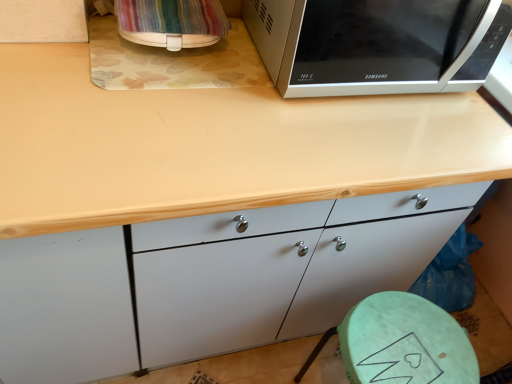
The height and width of the screenshot is (384, 512). Describe the element at coordinates (170, 22) in the screenshot. I see `striped fabric bag at upper left` at that location.

Describe the element at coordinates (215, 146) in the screenshot. I see `wooden at upper center` at that location.

Where is `sleek silver microwave at upper right`? sleek silver microwave at upper right is located at coordinates (368, 44).

The image size is (512, 384). Identify the location of green matte stool at lower right. (402, 343).

Which of these two, striped fabric bag at upper left or wooden at upper center, is wider?

wooden at upper center.

Looking at the image, does striped fabric bag at upper left seem bigger or smaller compared to wooden at upper center?

In the image, striped fabric bag at upper left appears to be smaller than wooden at upper center.

Considering the positions of objects striped fabric bag at upper left and wooden at upper center in the image provided, who is more to the right, striped fabric bag at upper left or wooden at upper center?

Positioned to the right is wooden at upper center.

From the image's perspective, which is above, striped fabric bag at upper left or wooden at upper center?

striped fabric bag at upper left is shown above in the image.

Does sleek silver microwave at upper right appear on the left side of wooden at upper center?

No, sleek silver microwave at upper right is not to the left of wooden at upper center.

Considering the sizes of sleek silver microwave at upper right and wooden at upper center in the image, is sleek silver microwave at upper right wider or thinner than wooden at upper center?

sleek silver microwave at upper right is thinner than wooden at upper center.

Identify the location of microwave oven above the wooden at upper center (from the image's perspective). This screenshot has height=384, width=512. (368, 44).

Is sleek silver microwave at upper right inside or outside of wooden at upper center?

sleek silver microwave at upper right cannot be found inside wooden at upper center.

In terms of width, does striped fabric bag at upper left look wider or thinner when compared to sleek silver microwave at upper right?

Considering their sizes, striped fabric bag at upper left looks slimmer than sleek silver microwave at upper right.

Can you confirm if striped fabric bag at upper left is positioned to the left of sleek silver microwave at upper right?

Yes, striped fabric bag at upper left is to the left of sleek silver microwave at upper right.

Who is bigger, striped fabric bag at upper left or sleek silver microwave at upper right?

With larger size is sleek silver microwave at upper right.

Between green matte stool at lower right and wooden at upper center, which one appears on the right side from the viewer's perspective?

green matte stool at lower right.

Which of these two, green matte stool at lower right or wooden at upper center, stands shorter?

Standing shorter between the two is green matte stool at lower right.

Does green matte stool at lower right have a smaller size compared to wooden at upper center?

Indeed, green matte stool at lower right has a smaller size compared to wooden at upper center.

From the image's perspective, relative to wooden at upper center, is green matte stool at lower right above or below?

green matte stool at lower right is situated lower than wooden at upper center in the image.

From a real-world perspective, between sleek silver microwave at upper right and green matte stool at lower right, who is vertically higher?

sleek silver microwave at upper right is physically above.

In the scene shown: Is sleek silver microwave at upper right positioned far away from green matte stool at lower right?

No, there isn't a large distance between sleek silver microwave at upper right and green matte stool at lower right.

The height and width of the screenshot is (384, 512). Find the location of `round table that is on the right side of sleek silver microwave at upper right`. round table that is on the right side of sleek silver microwave at upper right is located at coordinates (402, 343).

Between point (357, 335) and point (155, 15), which one is positioned behind?

The point (357, 335) is farther.

Is green matte stool at lower right thinner than striped fabric bag at upper left?

No, green matte stool at lower right is not thinner than striped fabric bag at upper left.

From the image's perspective, which object appears higher, green matte stool at lower right or striped fabric bag at upper left?

From the image's view, striped fabric bag at upper left is above.

Is green matte stool at lower right situated inside striped fabric bag at upper left or outside?

green matte stool at lower right is outside striped fabric bag at upper left.

In the image, is wooden at upper center on the left side or the right side of green matte stool at lower right?

wooden at upper center is positioned on green matte stool at lower right's left side.

Can you confirm if wooden at upper center is smaller than green matte stool at lower right?

Incorrect, wooden at upper center is not smaller in size than green matte stool at lower right.

Is wooden at upper center not within green matte stool at lower right?

Absolutely, wooden at upper center is external to green matte stool at lower right.

Is point (45, 195) positioned behind point (438, 331)?

No, (45, 195) is in front of (438, 331).

Identify the location of appliance above the wooden at upper center (from a real-world perspective). This screenshot has width=512, height=384. (170, 22).

Locate an element on the screen. The image size is (512, 384). microwave oven to the right of wooden at upper center is located at coordinates 368,44.

From the image, which object appears to be farther from striped fabric bag at upper left, wooden at upper center or sleek silver microwave at upper right?

Among the two, sleek silver microwave at upper right is located further to striped fabric bag at upper left.

When comparing their distances from striped fabric bag at upper left, does green matte stool at lower right or sleek silver microwave at upper right seem closer?

sleek silver microwave at upper right is closer to striped fabric bag at upper left.

From the image, which object appears to be farther from sleek silver microwave at upper right, striped fabric bag at upper left or wooden at upper center?

Among the two, striped fabric bag at upper left is located further to sleek silver microwave at upper right.

Looking at the image, which one is located further to wooden at upper center, sleek silver microwave at upper right or striped fabric bag at upper left?

The object further to wooden at upper center is striped fabric bag at upper left.

From the image, which object appears to be nearer to sleek silver microwave at upper right, wooden at upper center or striped fabric bag at upper left?

Among the two, wooden at upper center is located nearer to sleek silver microwave at upper right.

Considering their positions, is striped fabric bag at upper left positioned further to wooden at upper center than sleek silver microwave at upper right?

Based on the image, striped fabric bag at upper left appears to be further to wooden at upper center.

Estimate the real-world distances between objects in this image. Which object is further from green matte stool at lower right, wooden at upper center or striped fabric bag at upper left?

striped fabric bag at upper left.

When comparing their distances from striped fabric bag at upper left, does sleek silver microwave at upper right or green matte stool at lower right seem closer?

The object closer to striped fabric bag at upper left is sleek silver microwave at upper right.

Find the location of a particular element. appliance between sleek silver microwave at upper right and wooden at upper center vertically is located at coordinates (170, 22).

Where is `countertop between striped fabric bag at upper left and green matte stool at lower right in the up-down direction`? The width and height of the screenshot is (512, 384). countertop between striped fabric bag at upper left and green matte stool at lower right in the up-down direction is located at coordinates (215, 146).

This screenshot has height=384, width=512. What are the coordinates of `countertop between sleek silver microwave at upper right and green matte stool at lower right in the vertical direction` in the screenshot? It's located at (215, 146).

You are a GUI agent. You are given a task and a screenshot of the screen. Output one action in this format:
    pyautogui.click(x=<x>, y=<y>)
    Task: Click on the appliance between sleek silver microwave at upper right and green matte stool at lower right in the vertical direction
    
    Given the screenshot: What is the action you would take?
    pyautogui.click(x=170, y=22)